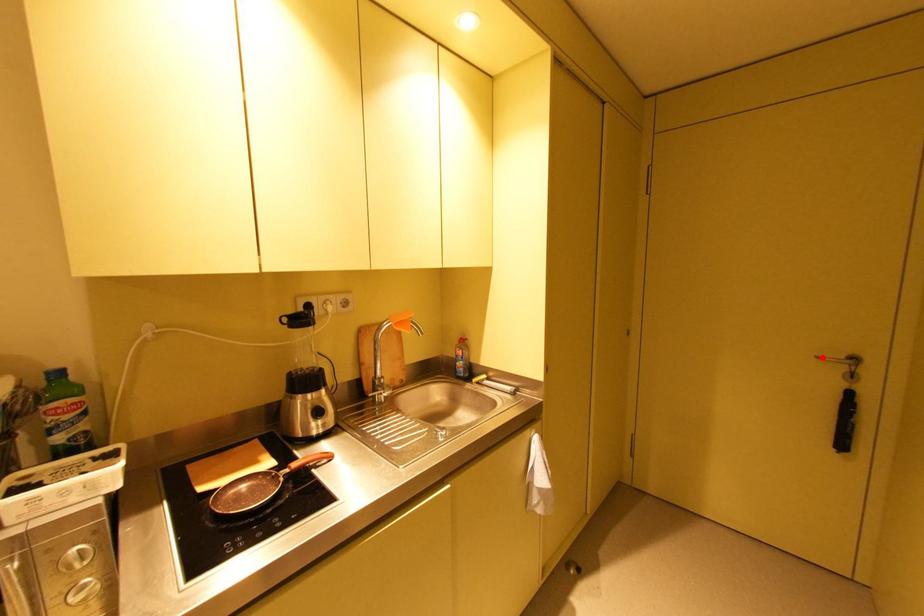
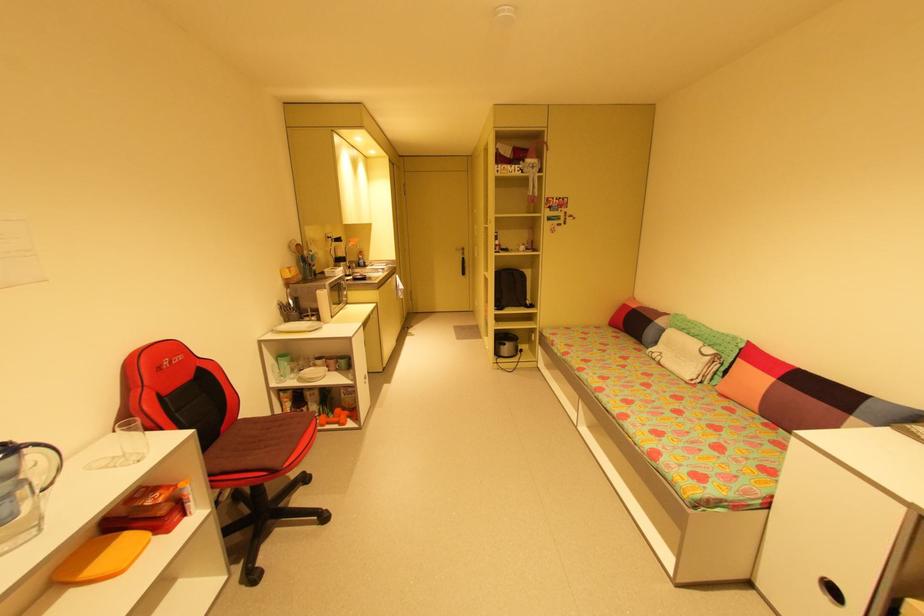
Question: A red point is marked in image1. In image2, is the corresponding 3D point closer to the camera or farther? Reply with the corresponding letter.

Choices:
 (A) The corresponding 3D point is closer.
 (B) The corresponding 3D point is farther.

Answer: (A)